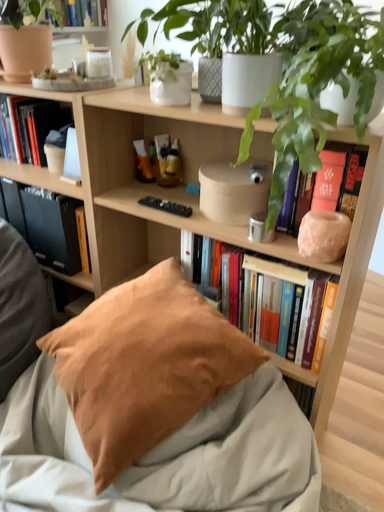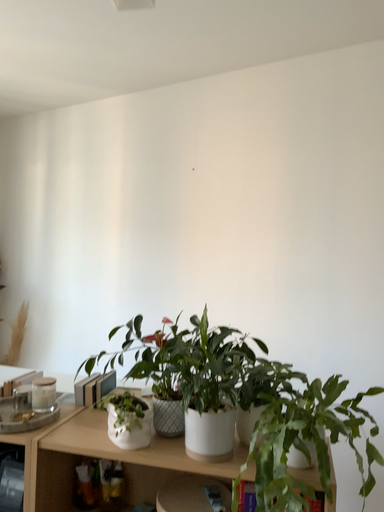
Question: How did the camera likely rotate when shooting the video?

Choices:
 (A) rotated right
 (B) rotated left

Answer: (A)